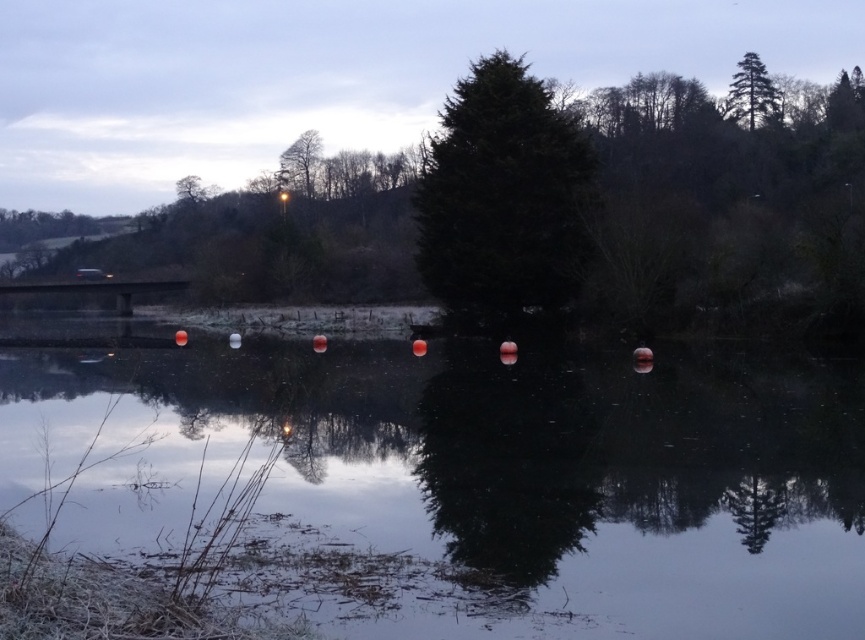
Question: Considering the relative positions of transparent glass river at center and green matte tree at upper center in the image provided, where is transparent glass river at center located with respect to green matte tree at upper center?

Choices:
 (A) left
 (B) right

Answer: (B)

Question: Among these points, which one is nearest to the camera?

Choices:
 (A) (527, 257)
 (B) (734, 109)
 (C) (828, 484)
 (D) (37, 224)

Answer: (C)

Question: Does dark green textured tree at center appear over green matte tree at upper left?

Choices:
 (A) yes
 (B) no

Answer: (A)

Question: Is transparent glass river at center behind green matte tree at upper left?

Choices:
 (A) yes
 (B) no

Answer: (B)

Question: Based on their relative distances, which object is nearer to the green textured pine tree at upper right?

Choices:
 (A) green matte tree at upper center
 (B) green matte tree at upper left
 (C) transparent glass river at center
 (D) dark green textured tree at center

Answer: (A)

Question: Among these points, which one is nearest to the camera?

Choices:
 (A) (305, 179)
 (B) (564, 564)

Answer: (B)